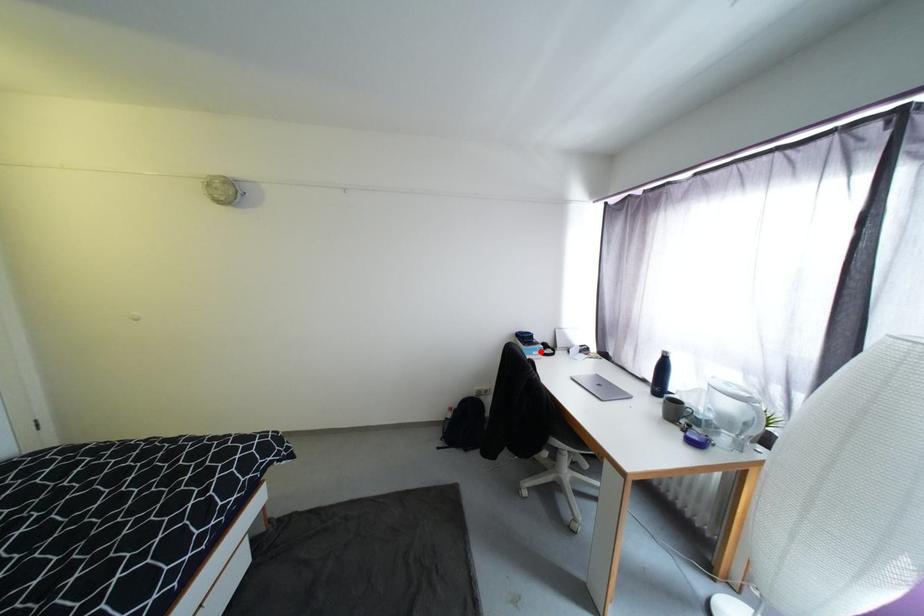
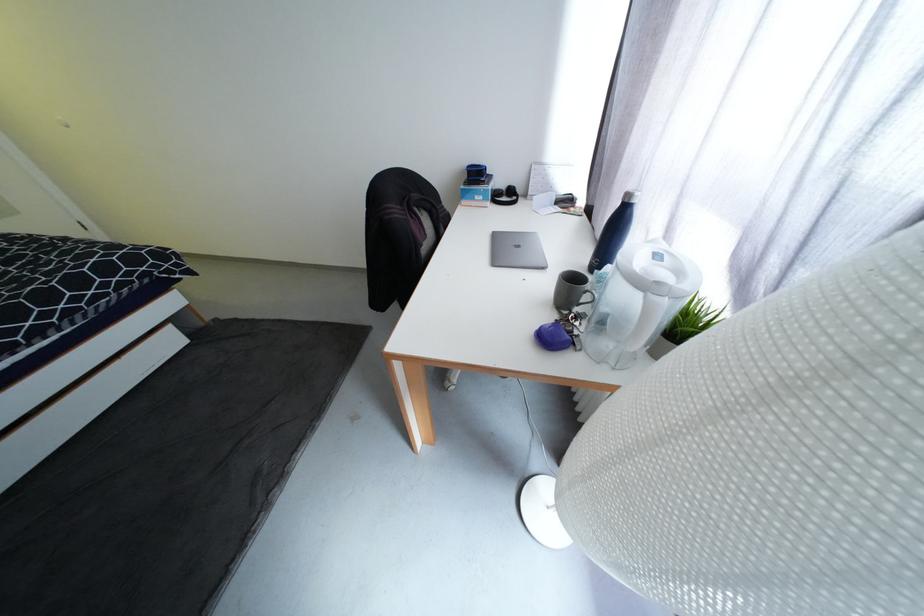
Locate, in the second image, the point that corresponds to the highlighted location in the first image.

(484, 195)